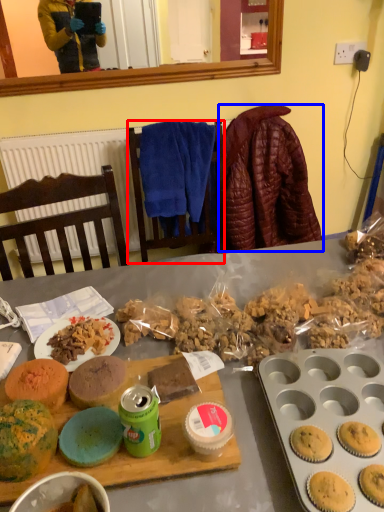
Question: Which object appears farthest to the camera in this image, chair (highlighted by a red box) or blanket (highlighted by a blue box)?

Choices:
 (A) chair
 (B) blanket

Answer: (B)